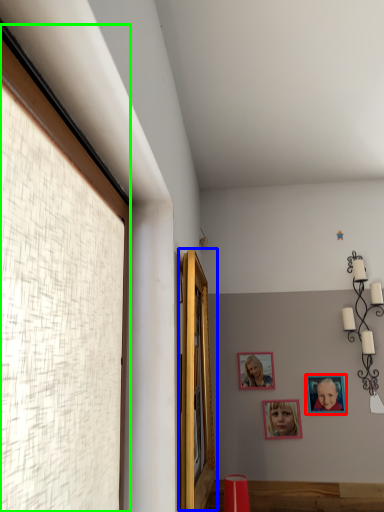
Question: Considering the real-world distances, which object is farthest from picture frame (highlighted by a red box)? window (highlighted by a blue box) or window (highlighted by a green box)?

Choices:
 (A) window
 (B) window

Answer: (B)